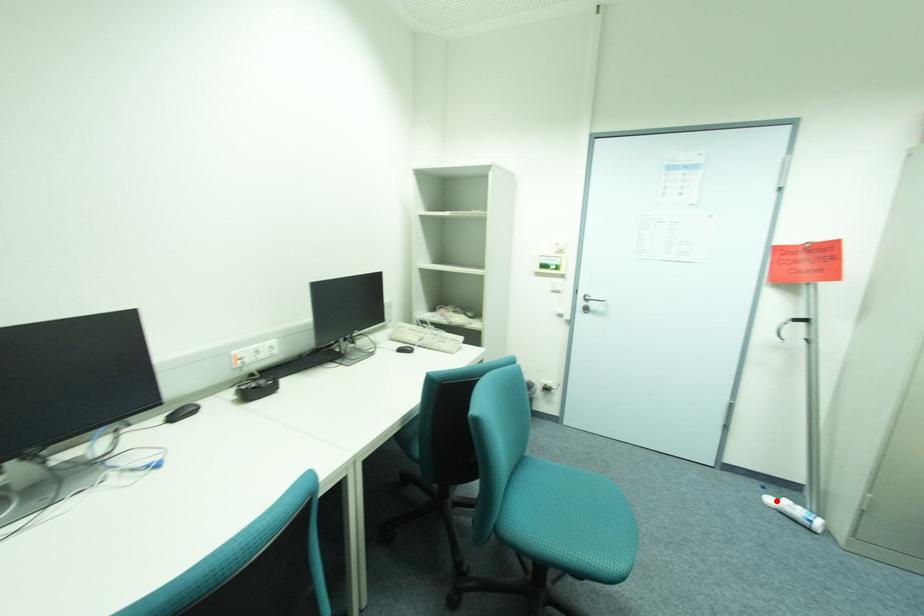
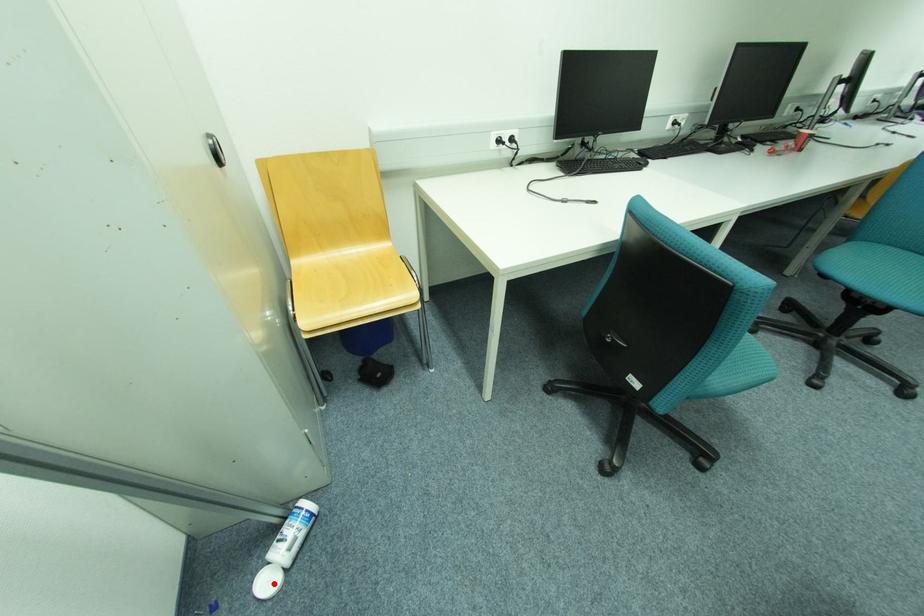
I am providing you with two images of the same scene from different viewpoints. A red point is marked on the first image and another point is marked on the second image. Do the highlighted points in image1 and image2 indicate the same real-world spot?

Yes